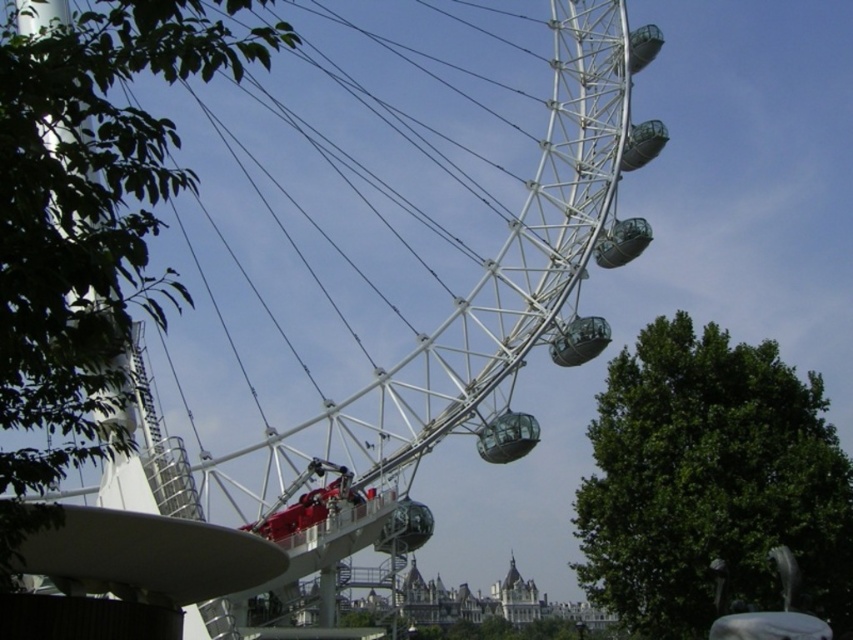
Who is higher up, green leafy tree at left or green leafy tree at right?

green leafy tree at left is higher up.

Can you confirm if green leafy tree at left is positioned to the right of green leafy tree at right?

Incorrect, green leafy tree at left is not on the right side of green leafy tree at right.

Does point (90, 316) lie in front of point (619, 499)?

Yes, it is.

Locate an element on the screen. The width and height of the screenshot is (853, 640). green leafy tree at left is located at coordinates (88, 220).

Between point (405, 429) and point (706, 432), which one is positioned behind?

The point (706, 432) is behind.

Does white metallic ferris wheel at center have a greater width compared to green leafy tree at right?

Correct, the width of white metallic ferris wheel at center exceeds that of green leafy tree at right.

Which is in front, point (22, 316) or point (694, 518)?

Point (22, 316) is more forward.

This screenshot has height=640, width=853. Identify the location of white metallic ferris wheel at center. (299, 230).

Can you confirm if green leafy tree at left is taller than transparent glass pod at center?

Yes.

Find the location of a particular element. This screenshot has height=640, width=853. green leafy tree at left is located at coordinates click(88, 220).

The width and height of the screenshot is (853, 640). I want to click on green leafy tree at left, so click(88, 220).